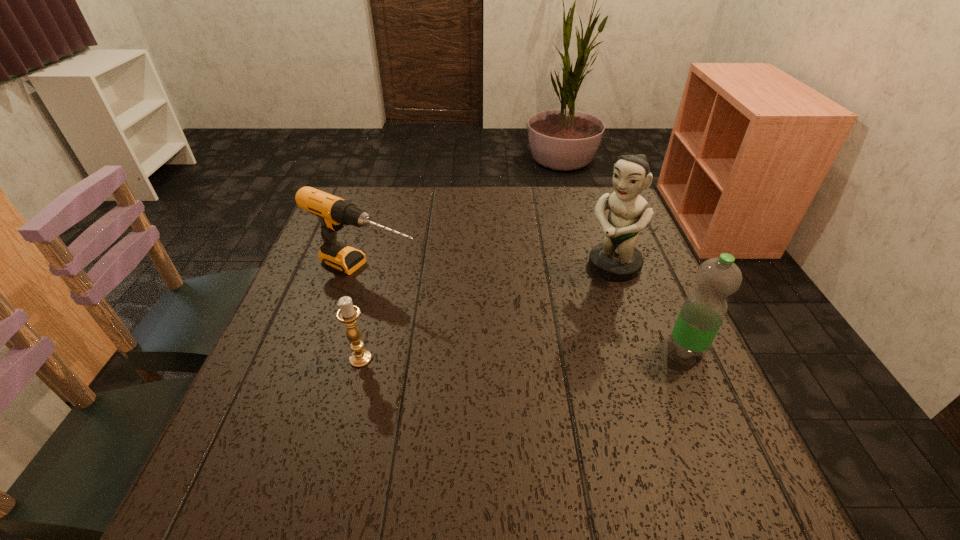
Locate an element on the screen. vacant point located between the figurine and the drill is located at coordinates (489, 268).

Select which object is the third closest to the tallest object. Please provide its 2D coordinates. Your answer should be formatted as a tuple, i.e. [(x, y)], where the tuple contains the x and y coordinates of a point satisfying the conditions above.

[(348, 313)]

Identify which object is the nearest to the water bottle. Please provide its 2D coordinates. Your answer should be formatted as a tuple, i.e. [(x, y)], where the tuple contains the x and y coordinates of a point satisfying the conditions above.

[(616, 258)]

Where is `vacant space that satisfies the following two spatial constraints: 1. on the front side of the second tallest object; 2. on the left side of the tallest object`? vacant space that satisfies the following two spatial constraints: 1. on the front side of the second tallest object; 2. on the left side of the tallest object is located at coordinates (642, 348).

Locate an element on the screen. This screenshot has width=960, height=540. free point that satisfies the following two spatial constraints: 1. on the back side of the candle holder; 2. on the right side of the figurine is located at coordinates (384, 265).

Identify the location of vacant space that satisfies the following two spatial constraints: 1. on the back side of the drill; 2. on the right side of the tallest object. This screenshot has width=960, height=540. (366, 265).